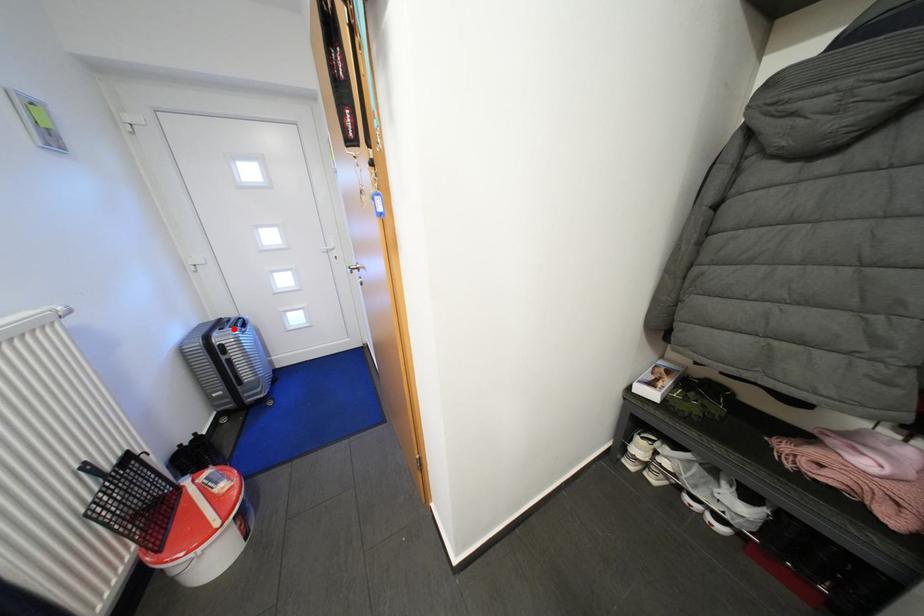
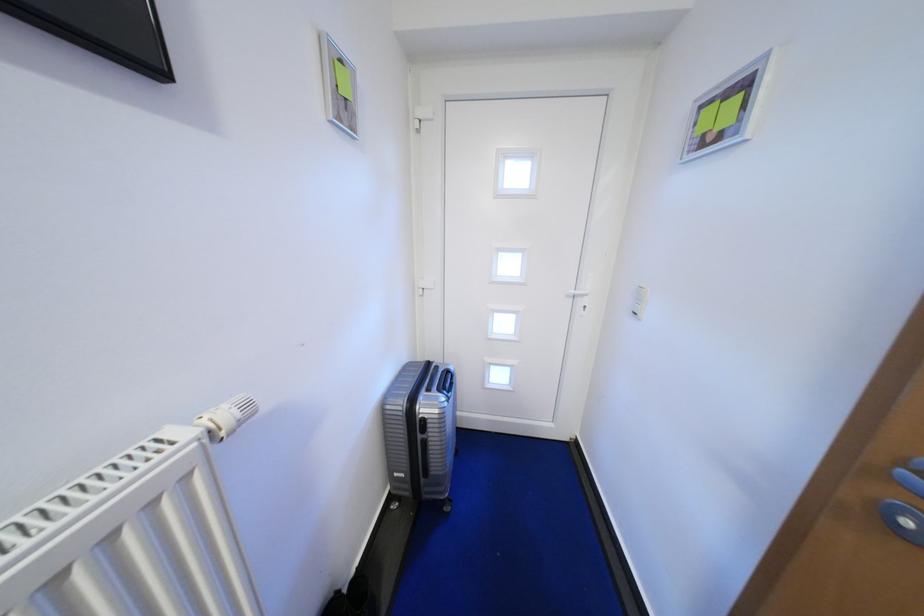
The point at the highlighted location is marked in the first image. Where is the corresponding point in the second image?

(441, 392)